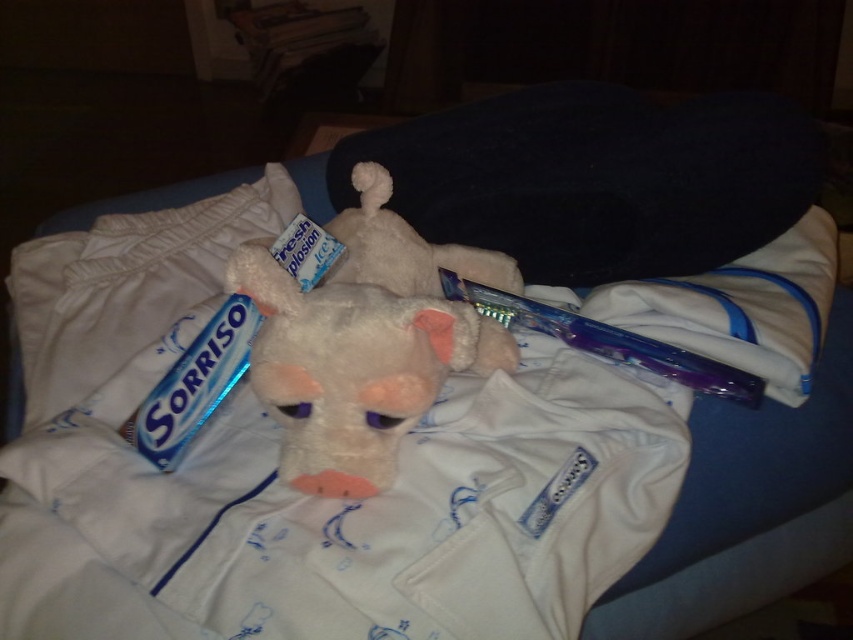
Question: Considering the relative positions of fluffy white plush toy at center and blue metallic toothpaste at lower left in the image provided, where is fluffy white plush toy at center located with respect to blue metallic toothpaste at lower left?

Choices:
 (A) below
 (B) above

Answer: (B)

Question: Which of the following is the farthest from the observer?

Choices:
 (A) (274, 268)
 (B) (474, 291)
 (C) (201, 406)

Answer: (B)

Question: Can you confirm if fluffy white plush toy at center is positioned to the left of purple glossy toothbrush at center?

Choices:
 (A) no
 (B) yes

Answer: (B)

Question: Which point is farther to the camera?

Choices:
 (A) blue metallic toothpaste at lower left
 (B) fluffy white plush toy at center

Answer: (A)

Question: Estimate the real-world distances between objects in this image. Which object is farther from the fluffy white plush toy at center?

Choices:
 (A) blue metallic toothpaste at lower left
 (B) purple glossy toothbrush at center

Answer: (B)

Question: Can you confirm if blue metallic toothpaste at lower left is positioned below purple glossy toothbrush at center?

Choices:
 (A) yes
 (B) no

Answer: (A)